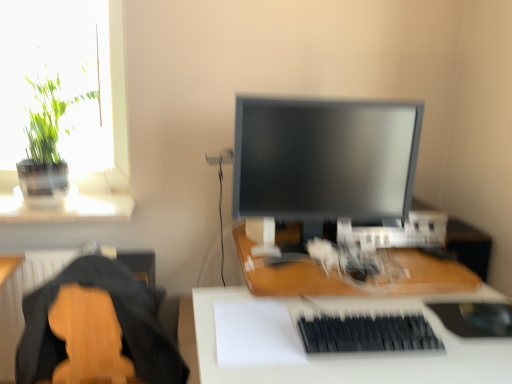
Question: From the image's perspective, is matte black monitor at center located above or below wooden desk at center, arranged as the 1th desk when viewed from the top?

Choices:
 (A) above
 (B) below

Answer: (A)

Question: Is matte black monitor at center taller or shorter than wooden desk at center, which appears as the second desk when ordered from the bottom?

Choices:
 (A) short
 (B) tall

Answer: (B)

Question: Considering the real-world distances, which object is closest to the white matte desk at center, which is counted as the first desk, starting from the bottom?

Choices:
 (A) green leafy plant at upper left
 (B) black matte keyboard at lower center
 (C) wooden desk at center, arranged as the 1th desk when viewed from the top
 (D) wooden guitar at lower left
 (E) matte black monitor at center

Answer: (B)

Question: Based on their relative distances, which object is farther from the wooden guitar at lower left?

Choices:
 (A) green leafy plant at upper left
 (B) matte black monitor at center
 (C) wooden desk at center, which appears as the second desk when ordered from the bottom
 (D) white matte desk at center, positioned as the second desk in top-to-bottom order
 (E) black matte keyboard at lower center

Answer: (E)